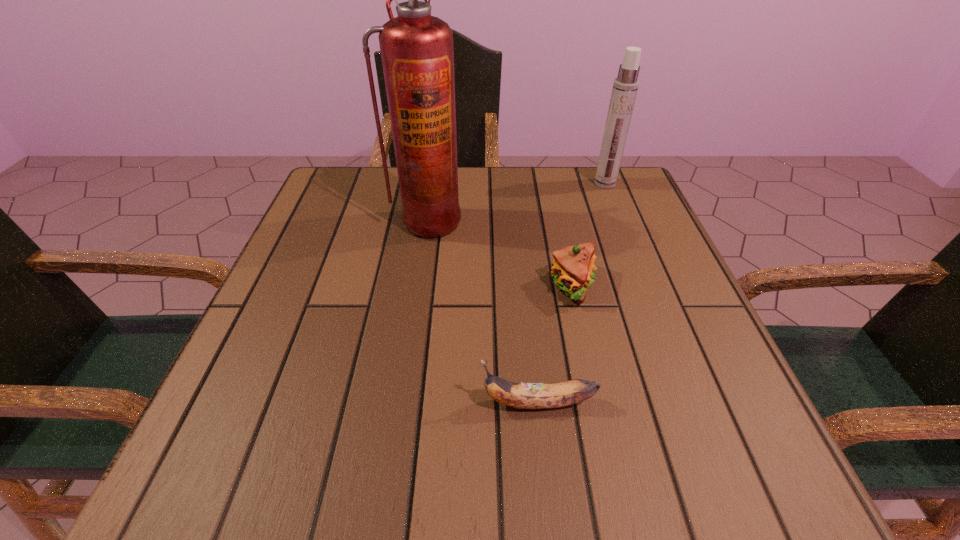
Identify the location of blank space at the far left corner of the desktop. (362, 214).

Locate an element on the screen. The width and height of the screenshot is (960, 540). vacant space at the far right corner of the desktop is located at coordinates (583, 191).

The height and width of the screenshot is (540, 960). In order to click on vacant space at the near right corner in this screenshot , I will do coord(765,461).

Where is `vacant space that is in between the rightmost object and the sandwich`? vacant space that is in between the rightmost object and the sandwich is located at coordinates (588, 235).

You are a GUI agent. You are given a task and a screenshot of the screen. Output one action in this format:
    pyautogui.click(x=<x>, y=<y>)
    Task: Click on the vacant point located between the sandwich and the fire extinguisher
    
    Given the screenshot: What is the action you would take?
    pyautogui.click(x=500, y=253)

What are the coordinates of `vacant space that's between the banana and the third nearest object` in the screenshot? It's located at (483, 312).

Locate an element on the screen. free spot between the sandwich and the farthest object is located at coordinates (588, 235).

Find the location of `blank region between the nearest object and the third farthest object`. blank region between the nearest object and the third farthest object is located at coordinates (555, 345).

Where is `vacant area between the tallest object and the rightmost object`? This screenshot has height=540, width=960. vacant area between the tallest object and the rightmost object is located at coordinates (516, 202).

Locate an element on the screen. The height and width of the screenshot is (540, 960). free space between the rightmost object and the fire extinguisher is located at coordinates (516, 202).